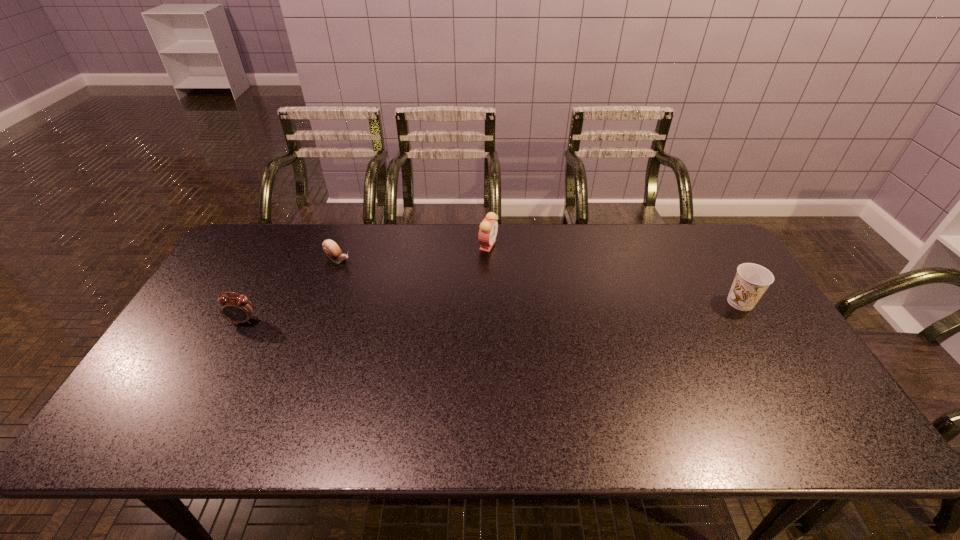
Find the location of a particular element. vacant spot on the desktop that is between the nearer alarm clock and the third farthest object and is positioned on the face of the third object from left to right is located at coordinates 547,309.

Locate an element on the screen. The image size is (960, 540). vacant space on the desktop that is between the nearer alarm clock and the Dixie cup and is positioned on the front-facing side of the escargot is located at coordinates (442, 313).